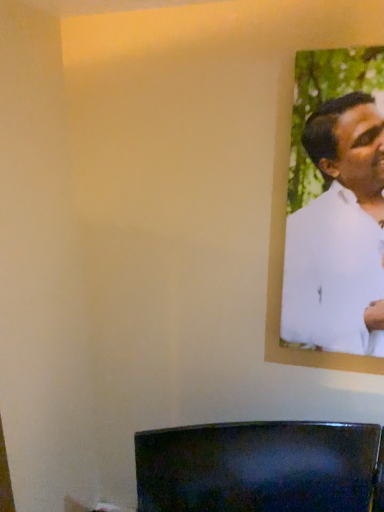
Question: Is white matte shirt at upper right to the left of glossy black tv at lower center from the viewer's perspective?

Choices:
 (A) no
 (B) yes

Answer: (A)

Question: Considering the relative positions of white matte shirt at upper right and glossy black tv at lower center in the image provided, is white matte shirt at upper right to the right of glossy black tv at lower center from the viewer's perspective?

Choices:
 (A) yes
 (B) no

Answer: (A)

Question: Considering the relative sizes of white matte shirt at upper right and glossy black tv at lower center in the image provided, is white matte shirt at upper right shorter than glossy black tv at lower center?

Choices:
 (A) no
 (B) yes

Answer: (A)

Question: Is white matte shirt at upper right closer to the viewer compared to glossy black tv at lower center?

Choices:
 (A) no
 (B) yes

Answer: (B)

Question: Could you tell me if white matte shirt at upper right is facing glossy black tv at lower center?

Choices:
 (A) yes
 (B) no

Answer: (B)

Question: From the image's perspective, is white matte shirt at upper right located beneath glossy black tv at lower center?

Choices:
 (A) no
 (B) yes

Answer: (A)

Question: Can you confirm if glossy black tv at lower center is taller than white matte shirt at upper right?

Choices:
 (A) yes
 (B) no

Answer: (B)

Question: Does glossy black tv at lower center turn towards white matte shirt at upper right?

Choices:
 (A) yes
 (B) no

Answer: (B)

Question: Does glossy black tv at lower center come behind white matte shirt at upper right?

Choices:
 (A) no
 (B) yes

Answer: (B)

Question: Is glossy black tv at lower center to the right of white matte shirt at upper right from the viewer's perspective?

Choices:
 (A) no
 (B) yes

Answer: (A)

Question: Is glossy black tv at lower center located outside white matte shirt at upper right?

Choices:
 (A) yes
 (B) no

Answer: (A)

Question: From the image's perspective, does glossy black tv at lower center appear lower than white matte shirt at upper right?

Choices:
 (A) yes
 (B) no

Answer: (A)

Question: From the image's perspective, is glossy black tv at lower center located above or below white matte shirt at upper right?

Choices:
 (A) below
 (B) above

Answer: (A)